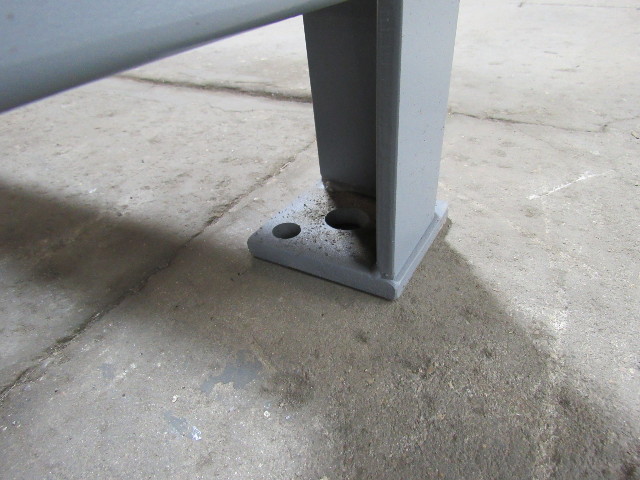
Identify the location of floor. (492, 289).